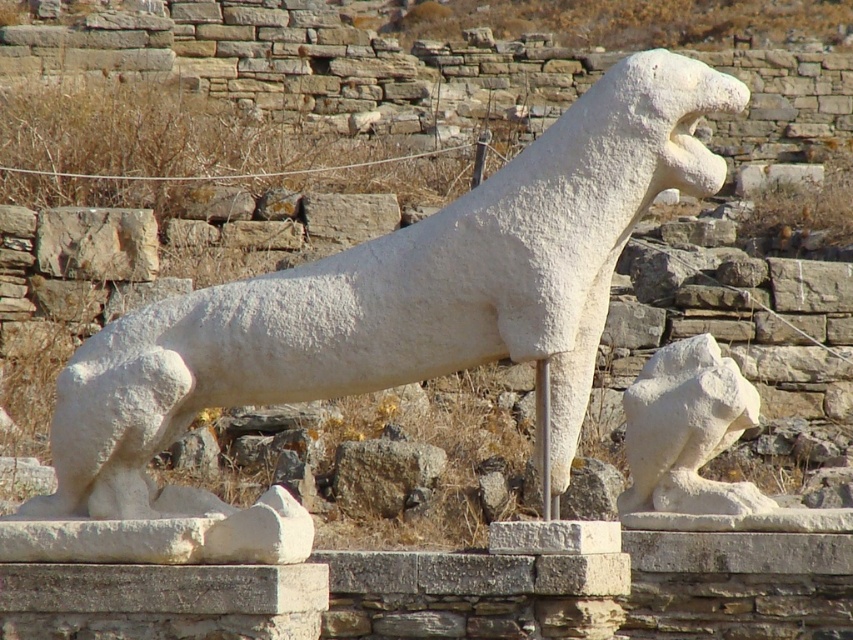
You are an archaeologist examining the archaeological site. You see the white marble dog at center and the white stone lion at lower right. Which object is positioned to the right side of the other?

The white marble dog at center is to the left of white stone lion at lower right, so the white stone lion at lower right is positioned to the right side of the white marble dog at center.

You are an archaeologist examining the sculptures. Which sculpture is bigger between the white marble dog at center and the white stone lion at lower right?

The white marble dog at center is larger in size compared to the white stone lion at lower right.

You are an archaeologist standing at the entrance of the site. You need to locate the white marble dog at center. Based on the coordinates provided, can you determine if it is positioned closer to the front or the back of the archaeological site?

The white marble dog at center is located at coordinates point (402, 296), which places it near the center of the site. Since the coordinates are close to 0.5 in both axes, it is centrally positioned, neither closer to the front nor the back.